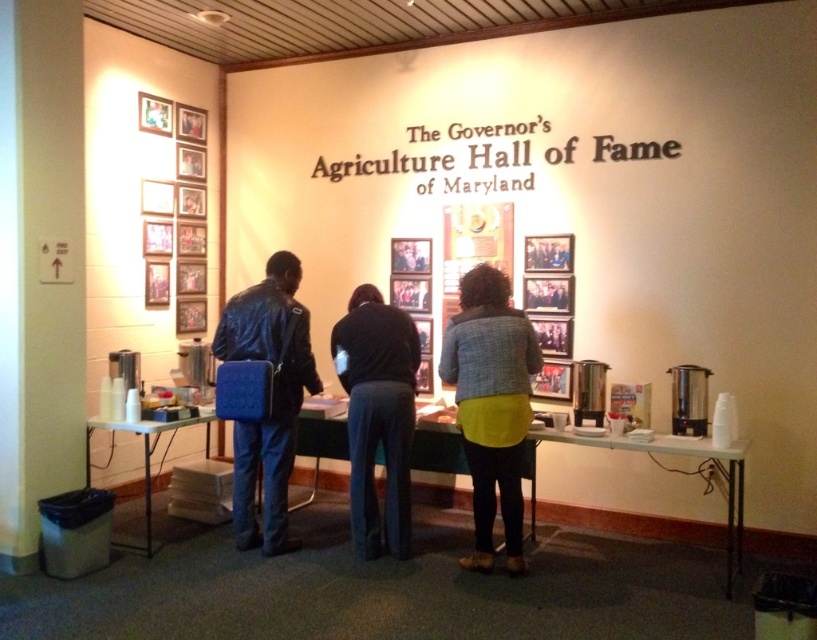
You are standing in the Agriculture Hall of Fame room and need to place a 36 inch wide decorative mat between the dark blue jeans at center and the white plastic table at lower center. Is there enough space to fit it?

The dark blue jeans at center is 39.35 inches from white plastic table at lower center. Since the mat is 36 inches wide, it can fit between them as the distance is greater than the mat width.